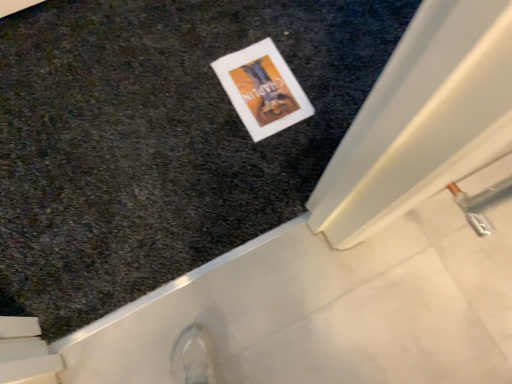
Identify the location of free location to the left of white paper at center. (187, 75).